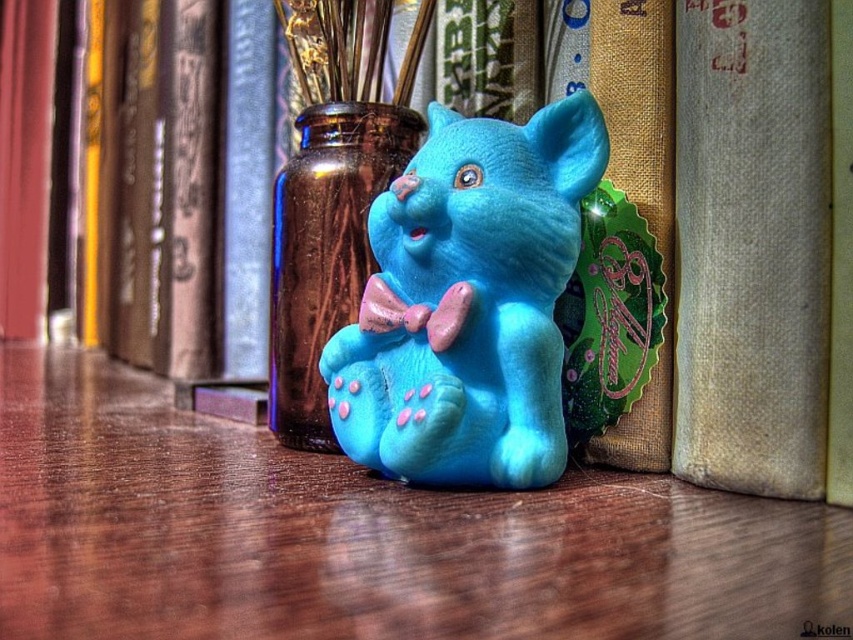
Between matte wooden table at center and matte blue plush cat at center, which one is positioned higher?

matte blue plush cat at center is above.

Does matte wooden table at center have a larger size compared to matte blue plush cat at center?

Indeed, matte wooden table at center has a larger size compared to matte blue plush cat at center.

Where is `matte wooden table at center`? Image resolution: width=853 pixels, height=640 pixels. matte wooden table at center is located at coordinates (363, 536).

Where is `matte wooden table at center`? matte wooden table at center is located at coordinates (363, 536).

Is matte blue plush cat at center positioned at the back of beige textured book at center?

Yes, it is behind beige textured book at center.

Is matte blue plush cat at center in front of beige textured book at center?

No, it is not.

What do you see at coordinates (468, 301) in the screenshot?
I see `matte blue plush cat at center` at bounding box center [468, 301].

I want to click on matte blue plush cat at center, so click(x=468, y=301).

Does matte wooden table at center have a smaller size compared to beige textured book at center?

Incorrect, matte wooden table at center is not smaller in size than beige textured book at center.

The image size is (853, 640). I want to click on matte wooden table at center, so click(x=363, y=536).

You are a GUI agent. You are given a task and a screenshot of the screen. Output one action in this format:
    pyautogui.click(x=<x>, y=<y>)
    Task: Click on the matte wooden table at center
    Image resolution: width=853 pixels, height=640 pixels.
    Given the screenshot: What is the action you would take?
    pyautogui.click(x=363, y=536)